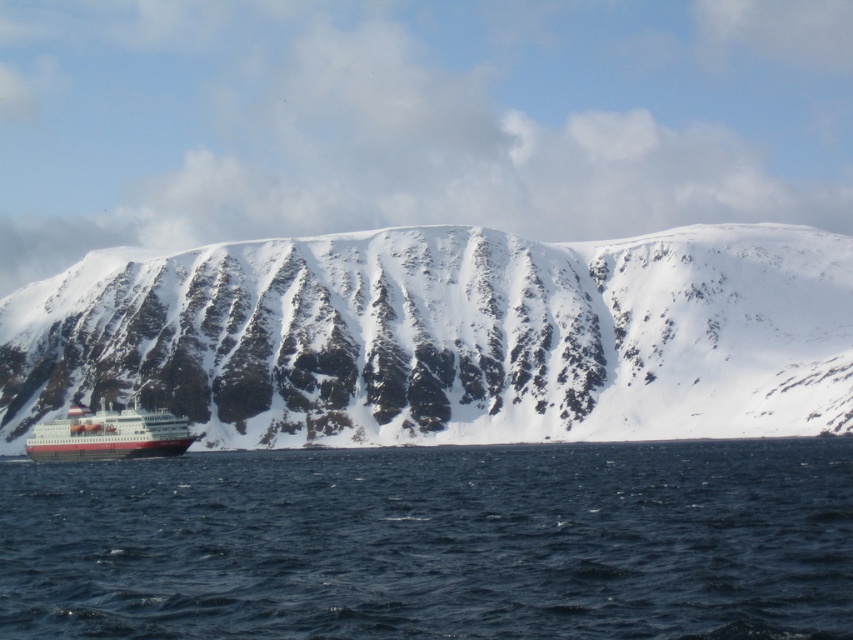
Question: Which point is closer to the camera taking this photo?

Choices:
 (A) (140, 440)
 (B) (608, 472)
 (C) (492, 369)

Answer: (B)

Question: Which object is closer to the camera taking this photo?

Choices:
 (A) snowy rock mountain at lower left
 (B) red matte ship at lower left

Answer: (A)

Question: Among these points, which one is nearest to the camera?

Choices:
 (A) (67, 454)
 (B) (479, 564)
 (C) (231, 252)

Answer: (B)

Question: From the image, what is the correct spatial relationship of blue water at lower center in relation to red matte ship at lower left?

Choices:
 (A) below
 (B) above

Answer: (A)

Question: Does snowy rock mountain at lower left appear under red matte ship at lower left?

Choices:
 (A) no
 (B) yes

Answer: (A)

Question: Can you confirm if snowy rock mountain at lower left is positioned below red matte ship at lower left?

Choices:
 (A) yes
 (B) no

Answer: (B)